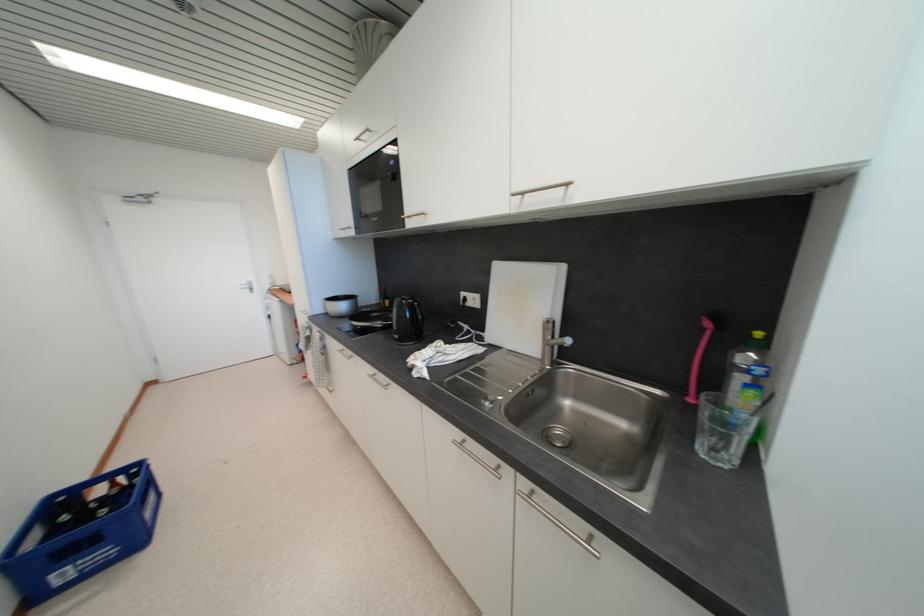
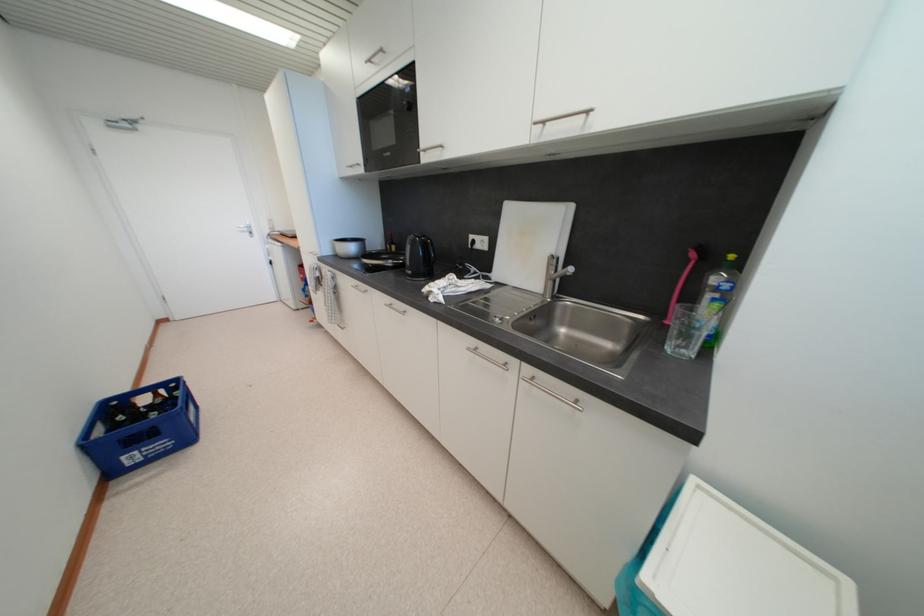
Question: How did the camera likely rotate?

Choices:
 (A) Left
 (B) Right
 (C) Up
 (D) Down

Answer: (D)